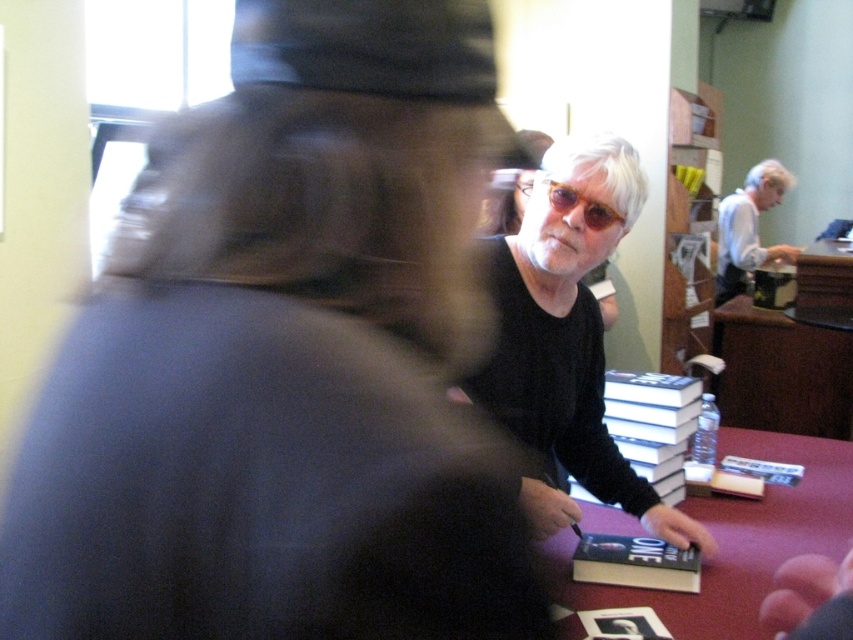
You are a photographer trying to capture a clear shot of the matte black shirt at center and the maroon fabric table at lower right. Since the blurred figure is in the foreground, which object would be easier to focus on?

The maroon fabric table at lower right is behind the matte black shirt at center, so it would be easier to focus on the matte black shirt at center since it is closer to the camera.

You are attending a book signing event and want to place your new hardcover book at center on the maroon fabric table at lower right. Can you reach the table from where you are standing?

The maroon fabric table at lower right is closer to the viewer than the hardcover book at center, so yes, you can reach the maroon fabric table at lower right from where you are standing.

You are a photographer at the event and need to position yourself so that the matte black shirt at center and clear plastic goggles at center are both in your shot. Which object should you place closer to the left side of your frame?

The matte black shirt at center should be placed closer to the left side of your frame because it is to the left of the clear plastic goggles at center.